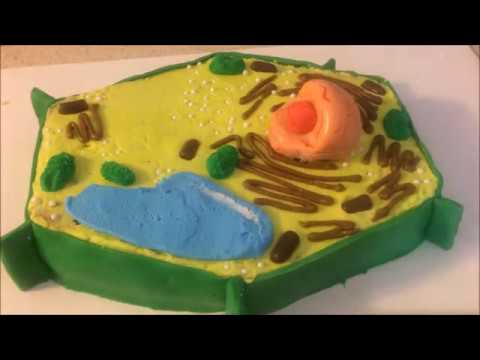
Locate an element on the screen. The width and height of the screenshot is (480, 360). white table background is located at coordinates (51, 302), (11, 153), (27, 55), (380, 57), (456, 84), (460, 177), (409, 294).